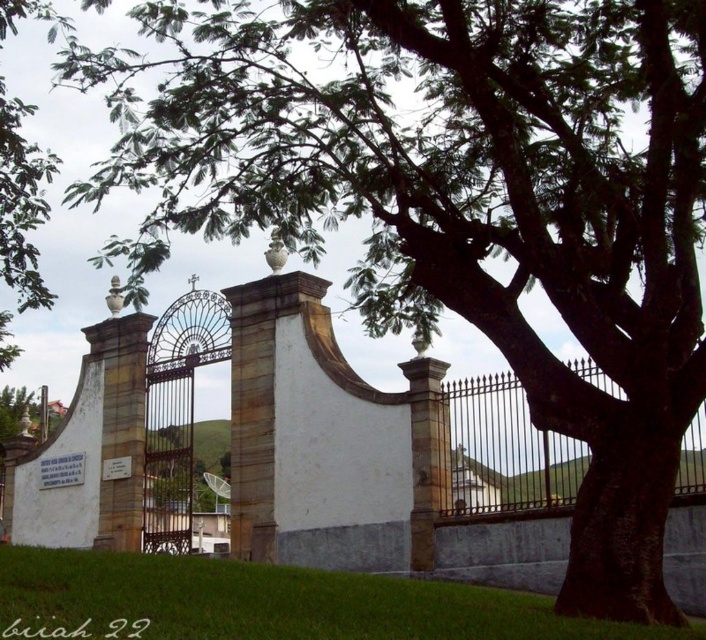
Question: Can you confirm if green grass at lower left is thinner than iron/golden gate at center?

Choices:
 (A) yes
 (B) no

Answer: (B)

Question: Is green grass at lower left below iron/golden gate at center?

Choices:
 (A) no
 (B) yes

Answer: (B)

Question: Which point is closer to the camera?

Choices:
 (A) iron/golden gate at center
 (B) green grass at lower left

Answer: (B)

Question: Which point appears farthest from the camera in this image?

Choices:
 (A) [x=167, y=604]
 (B) [x=532, y=492]

Answer: (B)

Question: Does green grass at lower left appear on the left side of iron/golden gate at center?

Choices:
 (A) no
 (B) yes

Answer: (B)